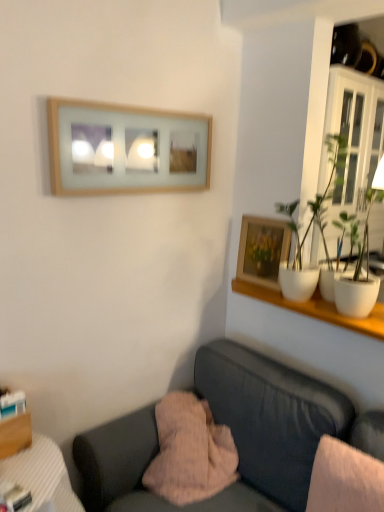
What is the approximate width of white glossy cabinet at upper right?

white glossy cabinet at upper right is 14.42 inches in width.

What do you see at coordinates (262, 250) in the screenshot? I see `wooden picture frame at upper right, the first picture frame positioned from the bottom` at bounding box center [262, 250].

Image resolution: width=384 pixels, height=512 pixels. What do you see at coordinates (316, 308) in the screenshot?
I see `white glossy shelf at upper right` at bounding box center [316, 308].

Find the location of a particular element. The height and width of the screenshot is (512, 384). white glossy shelf at upper right is located at coordinates (316, 308).

At what (x,y) coordinates should I click in order to perform the action: click on pink fuzzy pillow at lower center. Please return your answer as a coordinate pair (x, y). This screenshot has width=384, height=512. Looking at the image, I should click on (190, 452).

You are a GUI agent. You are given a task and a screenshot of the screen. Output one action in this format:
    pyautogui.click(x=<x>, y=<y>)
    Task: Click on the white glossy cabinet at upper right
    The height and width of the screenshot is (512, 384).
    Given the screenshot: What is the action you would take?
    pyautogui.click(x=353, y=141)

From a real-world perspective, is white glossy pot at upper right under wooden picture frame at upper right, the first picture frame in the right-to-left sequence?

No, from a real-world perspective, white glossy pot at upper right is not under wooden picture frame at upper right, the first picture frame in the right-to-left sequence.

In the image, there is a wooden picture frame at upper right, the first picture frame in the right-to-left sequence. At what (x,y) coordinates should I click in order to perform the action: click on houseplant above it (from the image's perspective). Please return your answer as a coordinate pair (x, y). Image resolution: width=384 pixels, height=512 pixels. Looking at the image, I should click on (317, 195).

Can you tell me how much white glossy pot at upper right and wooden picture frame at upper right, the first picture frame in the right-to-left sequence, differ in facing direction?

The angle between the facing direction of white glossy pot at upper right and the facing direction of wooden picture frame at upper right, the first picture frame in the right-to-left sequence, is 2.36 degrees.

Between white glossy pot at upper right and wooden picture frame at upper right, the first picture frame positioned from the bottom, which one has smaller width?

wooden picture frame at upper right, the first picture frame positioned from the bottom.

How many degrees apart are the facing directions of white glossy pot at upper right and pink fuzzy pillow at lower center?

white glossy pot at upper right and pink fuzzy pillow at lower center are facing 87.5 degrees away from each other.

Looking at this image, from a real-world perspective, which object rests below the other?

pink fuzzy pillow at lower center, from a real-world perspective.

The image size is (384, 512). What are the coordinates of `pillow below the white glossy pot at upper right (from the image's perspective)` in the screenshot? It's located at [190, 452].

From the image's perspective, does white glossy pot at upper right appear lower than pink fuzzy pillow at lower center?

No, from the image's perspective, white glossy pot at upper right is not below pink fuzzy pillow at lower center.

From a real-world perspective, is wooden picture frame at upper right, positioned as the second picture frame in top-to-bottom order, positioned above or below white glossy shelf at upper right?

Clearly, from a real-world perspective, wooden picture frame at upper right, positioned as the second picture frame in top-to-bottom order, is above white glossy shelf at upper right.

Is point (268, 275) closer or farther from the camera than point (325, 311)?

Point (268, 275) is positioned farther from the camera compared to point (325, 311).

Considering the sizes of wooden picture frame at upper right, marked as the second picture frame in a left-to-right arrangement, and white glossy shelf at upper right in the image, is wooden picture frame at upper right, marked as the second picture frame in a left-to-right arrangement, taller or shorter than white glossy shelf at upper right?

Considering their sizes, wooden picture frame at upper right, marked as the second picture frame in a left-to-right arrangement, has more height than white glossy shelf at upper right.

Based on their sizes in the image, would you say white glossy shelf at upper right is bigger or smaller than wooden picture frame at upper right, the first picture frame in the right-to-left sequence?

Clearly, white glossy shelf at upper right is larger in size than wooden picture frame at upper right, the first picture frame in the right-to-left sequence.

Based on their positions, is white glossy shelf at upper right located to the left or right of wooden picture frame at upper right, positioned as the second picture frame in top-to-bottom order?

From the image, it's evident that white glossy shelf at upper right is to the right of wooden picture frame at upper right, positioned as the second picture frame in top-to-bottom order.

Is white glossy shelf at upper right looking in the opposite direction of wooden picture frame at upper right, the first picture frame in the right-to-left sequence?

No, white glossy shelf at upper right's orientation is not away from wooden picture frame at upper right, the first picture frame in the right-to-left sequence.

Which picture frame is the 1st one when counting from the left side of the white glossy shelf at upper right? Please provide its 2D coordinates.

[(262, 250)]

Does white glossy pot at upper right lie in front of white glossy shelf at upper right?

Yes.

Considering the positions of point (312, 210) and point (381, 327), is point (312, 210) closer or farther from the camera than point (381, 327)?

Point (312, 210) appears to be farther away from the viewer than point (381, 327).

Can you tell me how much white glossy pot at upper right and white glossy shelf at upper right differ in facing direction?

There is a 1.99-degree angle between the facing directions of white glossy pot at upper right and white glossy shelf at upper right.

At what (x,y) coordinates should I click in order to perform the action: click on window frame to the right of wooden picture frame at upper right, the first picture frame positioned from the bottom. Please return your answer as a coordinate pair (x, y). Looking at the image, I should click on (353, 141).

Is point (240, 247) closer or farther from the camera than point (380, 108)?

Clearly, point (240, 247) is more distant from the camera than point (380, 108).

Consider the image. Considering the relative positions of wooden picture frame at upper right, the first picture frame positioned from the bottom, and white glossy cabinet at upper right in the image provided, is wooden picture frame at upper right, the first picture frame positioned from the bottom, in front of white glossy cabinet at upper right?

That is False.

What's the angular difference between wooden picture frame at upper right, positioned as the second picture frame in top-to-bottom order, and white glossy cabinet at upper right's facing directions?

The angle between the facing direction of wooden picture frame at upper right, positioned as the second picture frame in top-to-bottom order, and the facing direction of white glossy cabinet at upper right is 88.9 degrees.

Considering the positions of objects wooden picture frame at upper right, the first picture frame positioned from the bottom, and velvet dark gray couch at lower center in the image provided, who is in front, wooden picture frame at upper right, the first picture frame positioned from the bottom, or velvet dark gray couch at lower center?

velvet dark gray couch at lower center.

How many degrees apart are the facing directions of wooden picture frame at upper right, the first picture frame in the right-to-left sequence, and velvet dark gray couch at lower center?

There is a 0.101-degree angle between the facing directions of wooden picture frame at upper right, the first picture frame in the right-to-left sequence, and velvet dark gray couch at lower center.

In the image, is wooden picture frame at upper right, marked as the second picture frame in a left-to-right arrangement, on the left side or the right side of velvet dark gray couch at lower center?

Based on their positions, wooden picture frame at upper right, marked as the second picture frame in a left-to-right arrangement, is located to the right of velvet dark gray couch at lower center.

You are a GUI agent. You are given a task and a screenshot of the screen. Output one action in this format:
    pyautogui.click(x=<x>, y=<y>)
    Task: Click on the studio couch below the wooden picture frame at upper right, the first picture frame in the right-to-left sequence (from the image's perspective)
    The width and height of the screenshot is (384, 512).
    Given the screenshot: What is the action you would take?
    pyautogui.click(x=275, y=425)

The height and width of the screenshot is (512, 384). What are the coordinates of `the 1st picture frame counting from the left side of the white glossy pot at upper right` in the screenshot? It's located at (262, 250).

I want to click on pillow below the white glossy pot at upper right (from a real-world perspective), so click(x=190, y=452).

Estimate the real-world distances between objects in this image. Which object is further from white glossy pot at upper right, wooden picture frame at upper right, marked as the second picture frame in a left-to-right arrangement, or white glossy cabinet at upper right?

Among the two, wooden picture frame at upper right, marked as the second picture frame in a left-to-right arrangement, is located further to white glossy pot at upper right.

When comparing their distances from wooden frame at upper center, which ranks as the first picture frame in top-to-bottom order, does velvet dark gray couch at lower center or wooden picture frame at upper right, the first picture frame positioned from the bottom, seem closer?

wooden picture frame at upper right, the first picture frame positioned from the bottom, is positioned closer to the anchor wooden frame at upper center, which ranks as the first picture frame in top-to-bottom order.

Considering their positions, is white glossy cabinet at upper right positioned further to wooden frame at upper center, positioned as the 1th picture frame in left-to-right order, than wooden picture frame at upper right, positioned as the second picture frame in top-to-bottom order?

Based on the image, white glossy cabinet at upper right appears to be further to wooden frame at upper center, positioned as the 1th picture frame in left-to-right order.

Which object lies nearer to the anchor point velvet dark gray couch at lower center, white glossy shelf at upper right or pink fuzzy pillow at lower center?

pink fuzzy pillow at lower center is closer to velvet dark gray couch at lower center.

Based on their spatial positions, is white glossy pot at upper right or velvet dark gray couch at lower center closer to pink fuzzy pillow at lower center?

The object closer to pink fuzzy pillow at lower center is velvet dark gray couch at lower center.

Based on their spatial positions, is white glossy pot at upper right or pink fuzzy pillow at lower center closer to velvet dark gray couch at lower center?

The object closer to velvet dark gray couch at lower center is pink fuzzy pillow at lower center.

Looking at the image, which one is located closer to white glossy cabinet at upper right, white glossy shelf at upper right or velvet dark gray couch at lower center?

white glossy shelf at upper right is positioned closer to the anchor white glossy cabinet at upper right.

When comparing their distances from white glossy cabinet at upper right, does pink fuzzy pillow at lower center or white glossy shelf at upper right seem closer?

white glossy shelf at upper right.

You are a GUI agent. You are given a task and a screenshot of the screen. Output one action in this format:
    pyautogui.click(x=<x>, y=<y>)
    Task: Click on the picture frame that lies between white glossy pot at upper right and pink fuzzy pillow at lower center from top to bottom
    The image size is (384, 512).
    Given the screenshot: What is the action you would take?
    pyautogui.click(x=262, y=250)

Locate an element on the screen. This screenshot has height=512, width=384. houseplant between wooden frame at upper center, positioned as the 1th picture frame in left-to-right order, and white glossy cabinet at upper right is located at coordinates (317, 195).

Locate an element on the screen. pillow between white glossy pot at upper right and velvet dark gray couch at lower center from top to bottom is located at coordinates (190, 452).

The width and height of the screenshot is (384, 512). I want to click on houseplant that lies between wooden frame at upper center, positioned as the 1th picture frame in left-to-right order, and velvet dark gray couch at lower center from top to bottom, so click(317, 195).